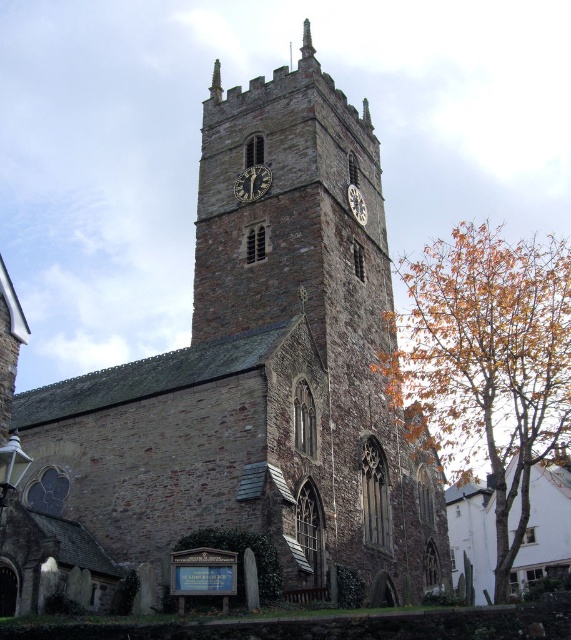
Based on the photo, does dark brown wooden clock at center have a greater height compared to metallic clock face at center?

In fact, dark brown wooden clock at center may be shorter than metallic clock face at center.

Does point (247, 182) lie behind point (359, 204)?

No, (247, 182) is closer to viewer.

Locate an element on the screen. The height and width of the screenshot is (640, 571). dark brown wooden clock at center is located at coordinates (252, 182).